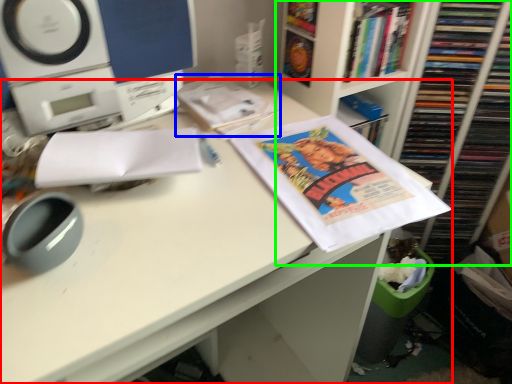
Question: Which object is positioned closest to desk (highlighted by a red box)? Select from book (highlighted by a blue box) and bookcase (highlighted by a green box).

Choices:
 (A) book
 (B) bookcase

Answer: (A)